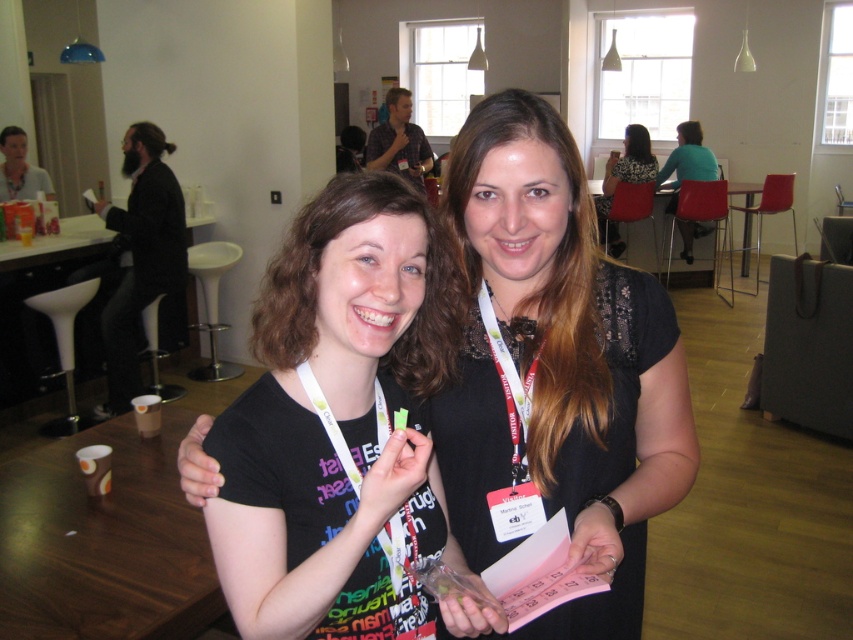
Question: Can you confirm if green matte paper at center is thinner than pink paper at center?

Choices:
 (A) yes
 (B) no

Answer: (B)

Question: Which of the following is the closest to the observer?

Choices:
 (A) teal fabric shirt at upper right
 (B) pink paper at center
 (C) black matte t-shirt at center
 (D) floral dress at center

Answer: (C)

Question: Can you confirm if black matte t-shirt at center is positioned above green matte paper at center?

Choices:
 (A) no
 (B) yes

Answer: (B)

Question: Can you confirm if white fabric lanyard at center is positioned to the right of teal fabric shirt at upper right?

Choices:
 (A) yes
 (B) no

Answer: (B)

Question: Among these objects, which one is farthest from the camera?

Choices:
 (A) black matte t-shirt at center
 (B) floral dress at center
 (C) pink paper at center

Answer: (B)

Question: Which object is positioned closest to the pink paper at center?

Choices:
 (A) black matte t-shirt at center
 (B) matte black hand at center
 (C) green matte paper at center

Answer: (C)